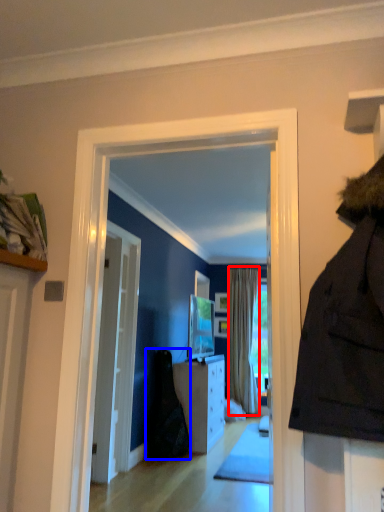
Question: Among these objects, which one is farthest to the camera, curtain (highlighted by a red box) or dark (highlighted by a blue box)?

Choices:
 (A) curtain
 (B) dark

Answer: (A)